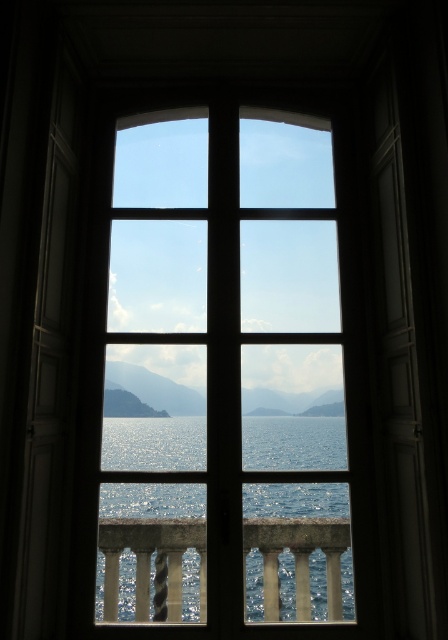
From the picture: Is clear glass window at center further to camera compared to polished stone balustrade at lower center?

No.

Between point (99, 504) and point (294, 545), which one is positioned in front?

Point (294, 545) is more forward.

Locate an element on the screen. clear glass window at center is located at coordinates click(223, 372).